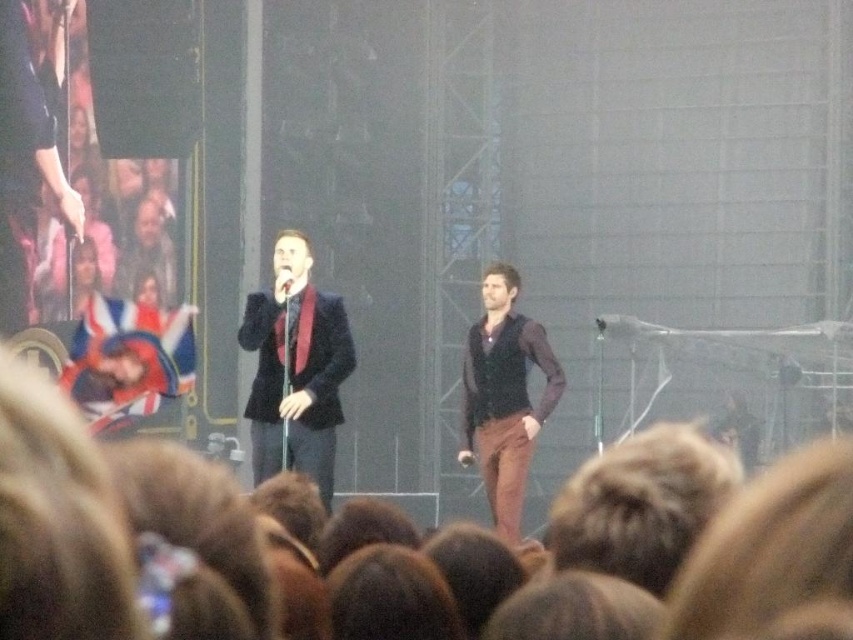
Does brown hair at lower center have a lesser width compared to metallic silver microphone at center?

No.

Does brown hair at lower center have a greater height compared to metallic silver microphone at center?

Indeed, brown hair at lower center has a greater height compared to metallic silver microphone at center.

You are a GUI agent. You are given a task and a screenshot of the screen. Output one action in this format:
    pyautogui.click(x=<x>, y=<y>)
    Task: Click on the brown hair at lower center
    The image size is (853, 640).
    Given the screenshot: What is the action you would take?
    pyautogui.click(x=641, y=504)

At what (x,y) coordinates should I click in order to perform the action: click on brown hair at lower center. Please return your answer as a coordinate pair (x, y). This screenshot has width=853, height=640. Looking at the image, I should click on (641, 504).

Based on the photo, between matte black suit at center and brown velvet vest at center, which one has less height?

Standing shorter between the two is matte black suit at center.

Is point (334, 388) positioned behind point (521, 483)?

That is False.

Where is `matte black suit at center`? The image size is (853, 640). matte black suit at center is located at coordinates 296,371.

Looking at this image, does brown velvet vest at center have a lesser height compared to metallic silver microphone at center?

No, brown velvet vest at center is not shorter than metallic silver microphone at center.

Between brown velvet vest at center and metallic silver microphone at center, which one is positioned lower?

brown velvet vest at center

The image size is (853, 640). What do you see at coordinates (503, 396) in the screenshot?
I see `brown velvet vest at center` at bounding box center [503, 396].

Locate an element on the screen. The height and width of the screenshot is (640, 853). brown velvet vest at center is located at coordinates 503,396.